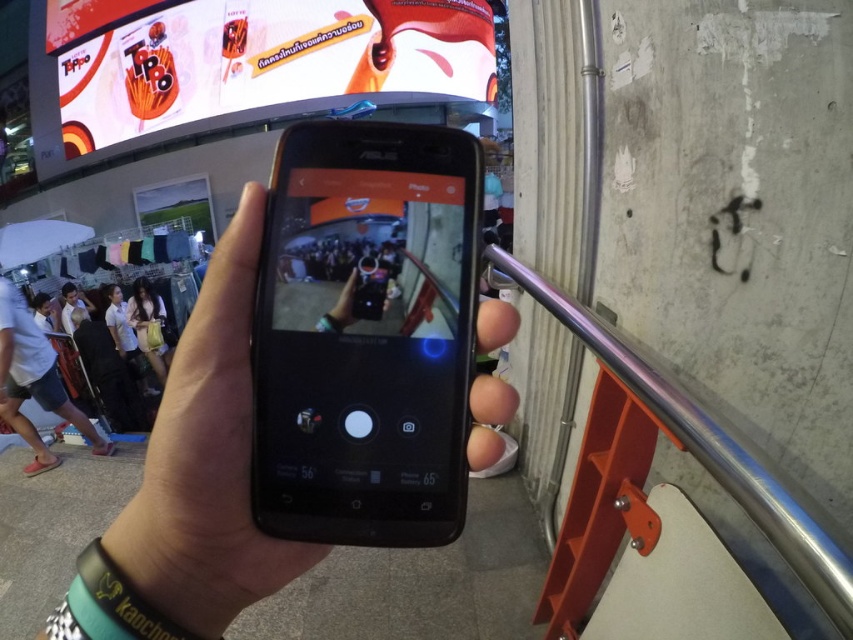
Who is positioned more to the left, metallic silver rail at right or black matte phone at center?

black matte phone at center is more to the left.

Is point (695, 451) more distant than point (335, 317)?

Yes, point (695, 451) is farther from viewer.

Find the location of a particular element. The image size is (853, 640). metallic silver rail at right is located at coordinates (706, 448).

Is metallic silver rail at right to the left of matte black dress at center from the viewer's perspective?

Incorrect, metallic silver rail at right is not on the left side of matte black dress at center.

Between metallic silver rail at right and matte black dress at center, which one has less height?

metallic silver rail at right

Is point (764, 492) more distant than point (146, 332)?

No.

In order to click on metallic silver rail at right in this screenshot , I will do `click(706, 448)`.

Between black matte smartphone at center and metallic silver rail at right, which one has more height?

metallic silver rail at right is taller.

Identify the location of black matte smartphone at center. (366, 336).

Where is `black matte smartphone at center`? black matte smartphone at center is located at coordinates (366, 336).